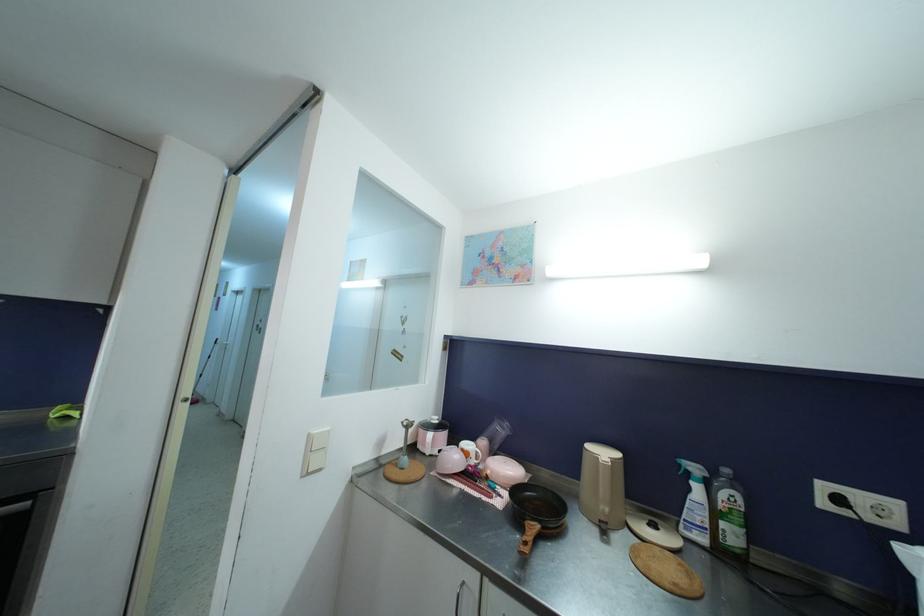
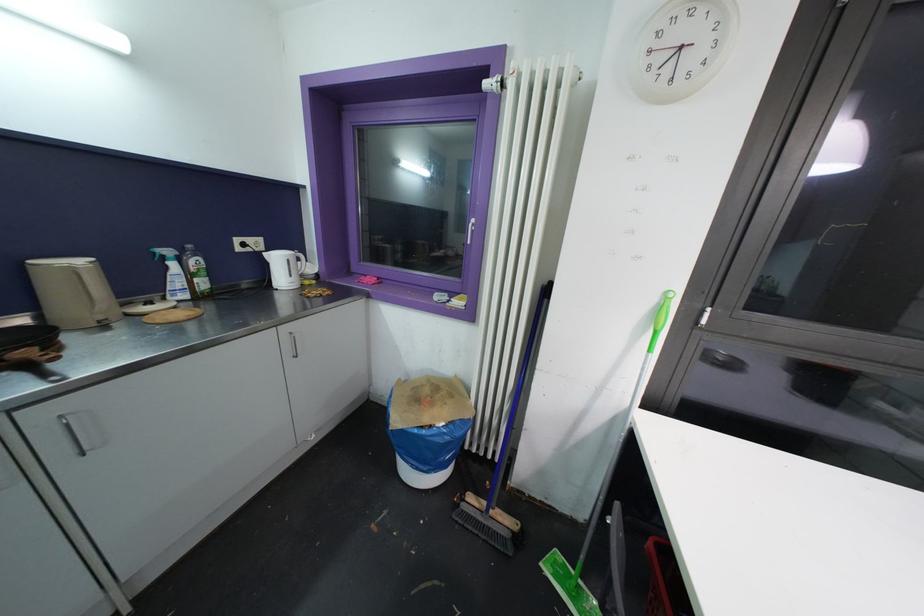
The point at (700, 490) is marked in the first image. Where is the corresponding point in the second image?

(176, 267)